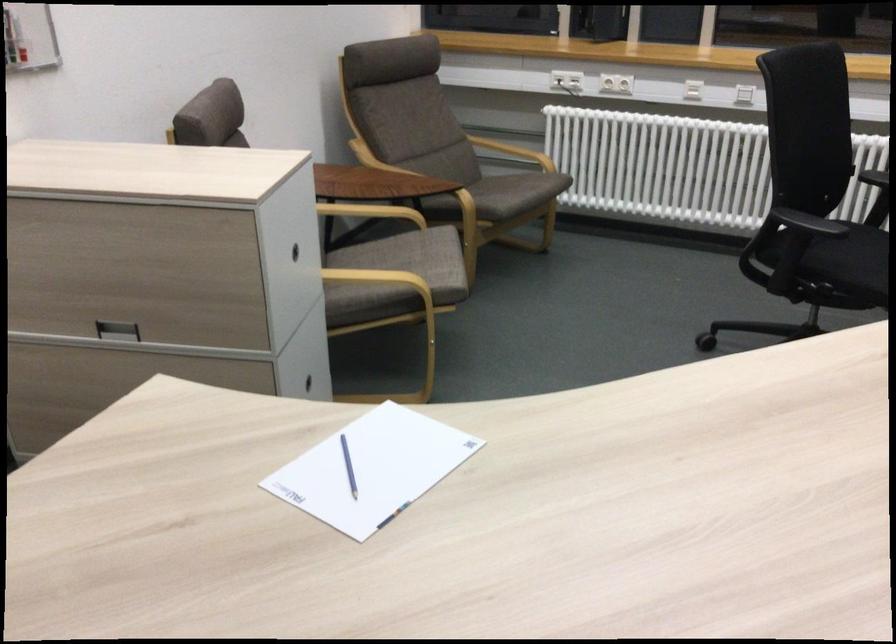
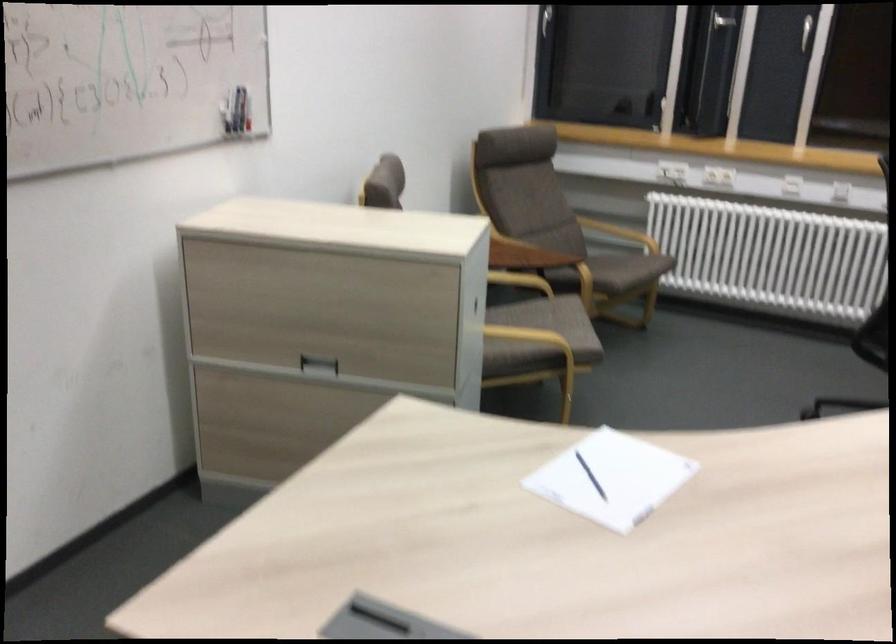
Where in the second image is the point corresponding to point 380,281 from the first image?

(528, 336)